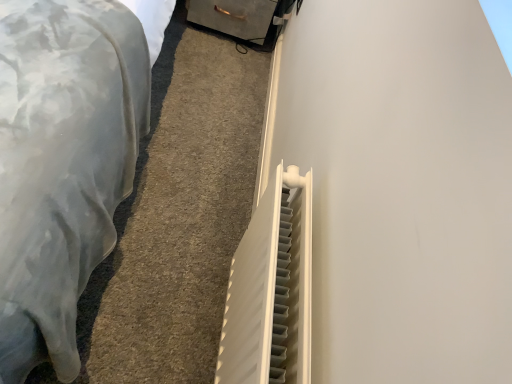
Question: Can you confirm if white plastic radiator at lower right is smaller than white plastic radiator at center-right?

Choices:
 (A) yes
 (B) no

Answer: (B)

Question: Is white plastic radiator at lower right thinner than white plastic radiator at center-right?

Choices:
 (A) yes
 (B) no

Answer: (B)

Question: Can you confirm if white plastic radiator at lower right is taller than white plastic radiator at center-right?

Choices:
 (A) yes
 (B) no

Answer: (B)

Question: From a real-world perspective, is white plastic radiator at lower right over white plastic radiator at center-right?

Choices:
 (A) no
 (B) yes

Answer: (A)

Question: From the image's perspective, is white plastic radiator at lower right under white plastic radiator at center-right?

Choices:
 (A) no
 (B) yes

Answer: (A)

Question: Is white plastic radiator at lower right with white plastic radiator at center-right?

Choices:
 (A) no
 (B) yes

Answer: (A)

Question: Are white plastic radiator at lower right and metallic gray drawer at upper center making contact?

Choices:
 (A) no
 (B) yes

Answer: (A)

Question: Can you confirm if white plastic radiator at lower right is thinner than metallic gray drawer at upper center?

Choices:
 (A) no
 (B) yes

Answer: (A)

Question: Does white plastic radiator at lower right appear on the right side of metallic gray drawer at upper center?

Choices:
 (A) no
 (B) yes

Answer: (A)

Question: Is white plastic radiator at lower right located outside metallic gray drawer at upper center?

Choices:
 (A) yes
 (B) no

Answer: (A)

Question: Can you confirm if white plastic radiator at lower right is shorter than metallic gray drawer at upper center?

Choices:
 (A) yes
 (B) no

Answer: (A)

Question: Considering the relative sizes of white plastic radiator at lower right and metallic gray drawer at upper center in the image provided, is white plastic radiator at lower right bigger than metallic gray drawer at upper center?

Choices:
 (A) yes
 (B) no

Answer: (B)

Question: Can you confirm if metallic gray drawer at upper center is taller than white plastic radiator at lower right?

Choices:
 (A) yes
 (B) no

Answer: (A)